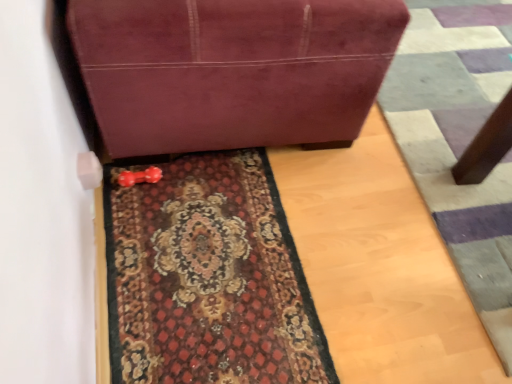
Find the location of `vacant space in front of suede-like maroon sofa at upper center`. vacant space in front of suede-like maroon sofa at upper center is located at coordinates (258, 253).